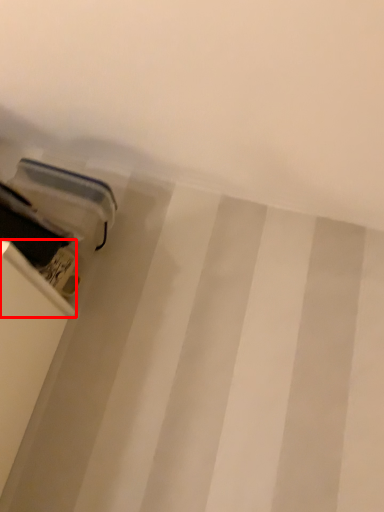
Question: Considering the relative positions of shelf (annotated by the red box) and equipment in the image provided, where is shelf (annotated by the red box) located with respect to the staircase?

Choices:
 (A) right
 (B) left

Answer: (B)